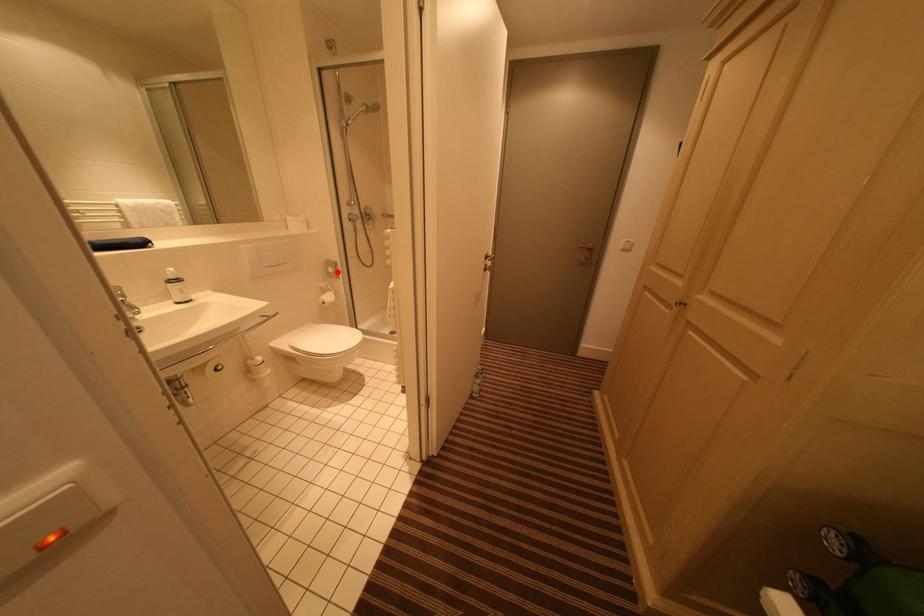
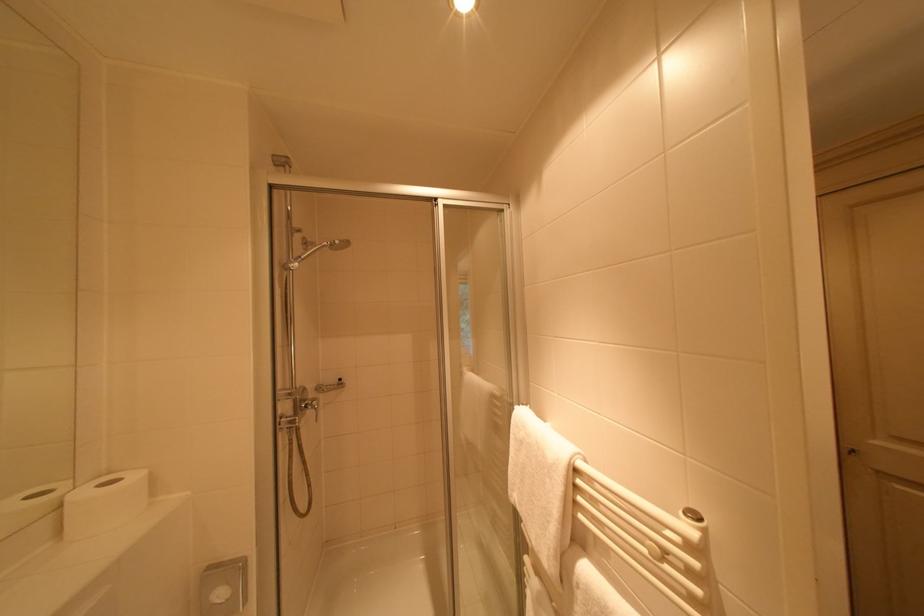
Where in the second image is the point corresponding to the highlighted location from the first image?

(226, 596)